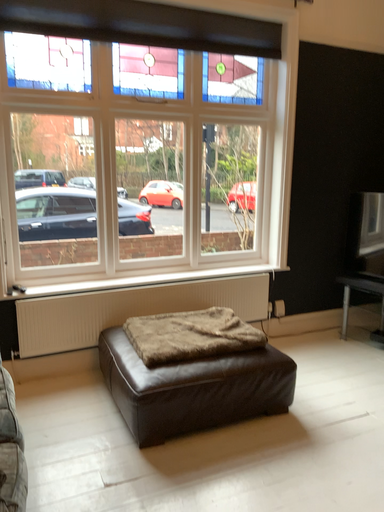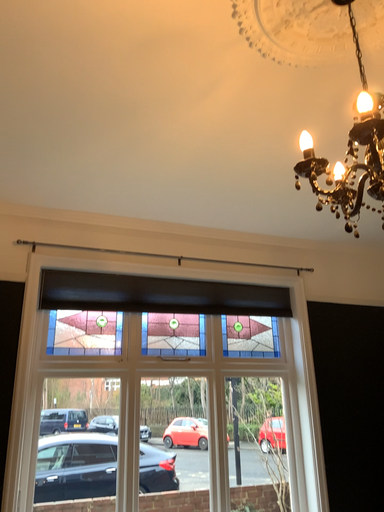
Question: Which way did the camera rotate in the video?

Choices:
 (A) rotated upward
 (B) rotated downward

Answer: (A)